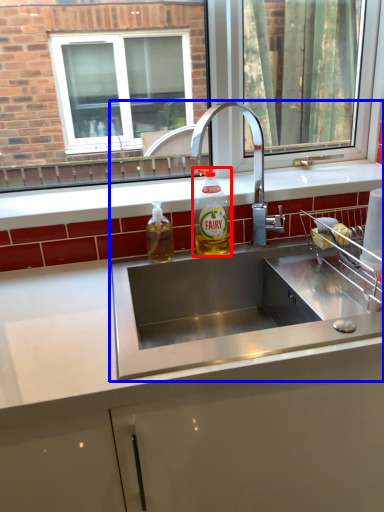
Question: Which object appears closest to the camera in this image, bottle (highlighted by a red box) or sink (highlighted by a blue box)?

Choices:
 (A) bottle
 (B) sink

Answer: (B)